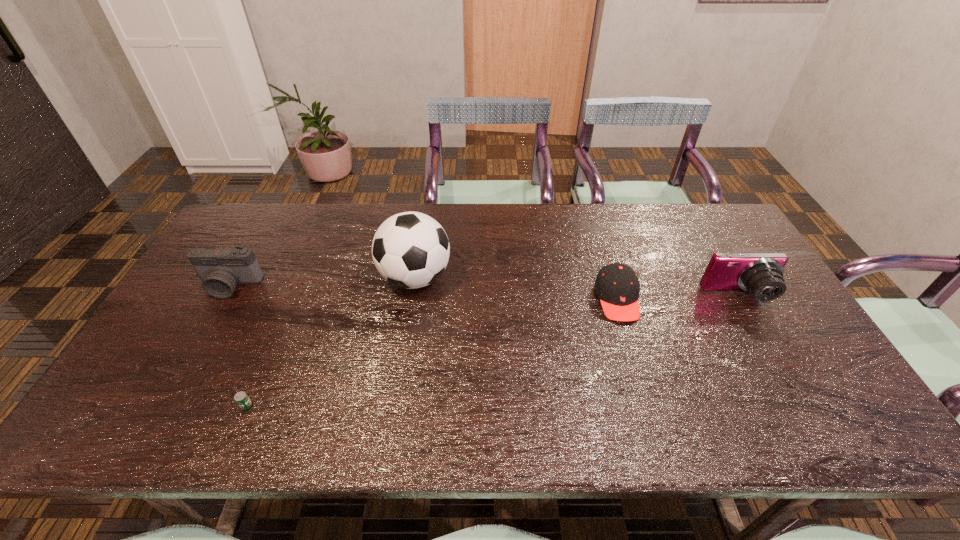
Locate which object is the fourth closest to the second shortest object. Please provide its 2D coordinates. Your answer should be formatted as a tuple, i.e. [(x, y)], where the tuple contains the x and y coordinates of a point satisfying the conditions above.

[(221, 269)]

Select which object appears as the closest to the second shortest object. Please provide its 2D coordinates. Your answer should be formatted as a tuple, i.e. [(x, y)], where the tuple contains the x and y coordinates of a point satisfying the conditions above.

[(761, 274)]

Identify the location of blank area in the image that satisfies the following two spatial constraints: 1. at the lens of the nearest object; 2. on the left side of the left camera. The width and height of the screenshot is (960, 540). click(x=161, y=406).